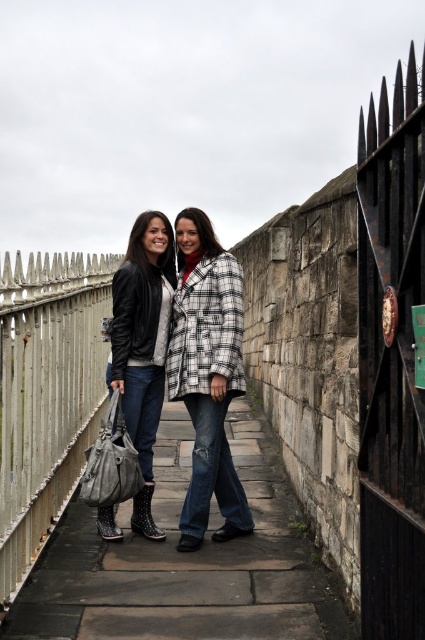
Question: Is leather boots at center to the right of white checkered coat at center from the viewer's perspective?

Choices:
 (A) no
 (B) yes

Answer: (B)

Question: Which point appears closest to the camera in this image?

Choices:
 (A) (x=44, y=536)
 (B) (x=308, y=579)
 (C) (x=405, y=172)
 (D) (x=152, y=314)

Answer: (C)

Question: Is leather boots at center thinner than white painted metal fence at left?

Choices:
 (A) yes
 (B) no

Answer: (B)

Question: In this image, where is leather boots at center located relative to white checkered coat at center?

Choices:
 (A) above
 (B) below

Answer: (B)

Question: Which object appears farthest from the camera in this image?

Choices:
 (A) white painted metal fence at left
 (B) matte black leather jacket at center
 (C) white checkered coat at center
 (D) leather boots at center

Answer: (C)

Question: Which of the following is the farthest from the observer?

Choices:
 (A) (164, 605)
 (B) (124, 401)
 (C) (414, 301)

Answer: (B)